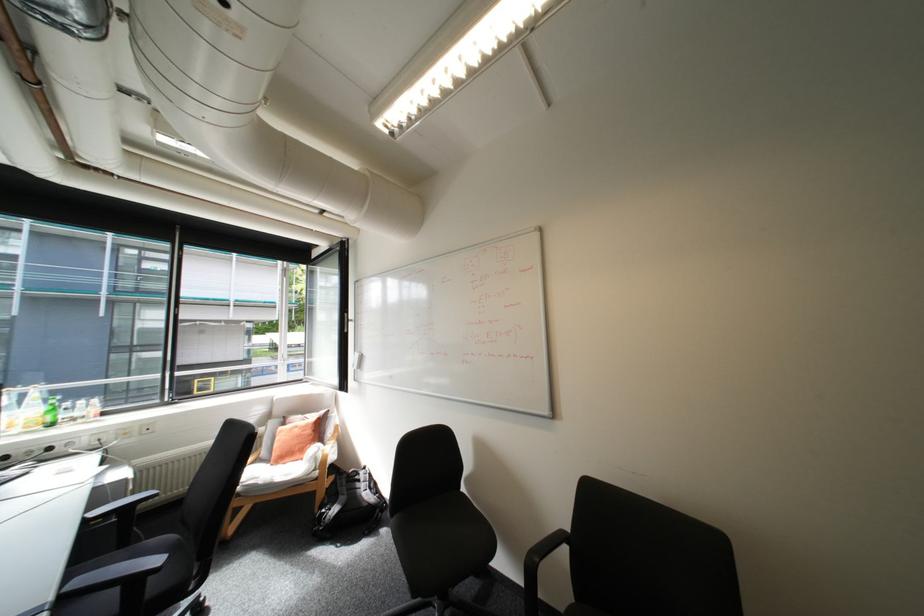
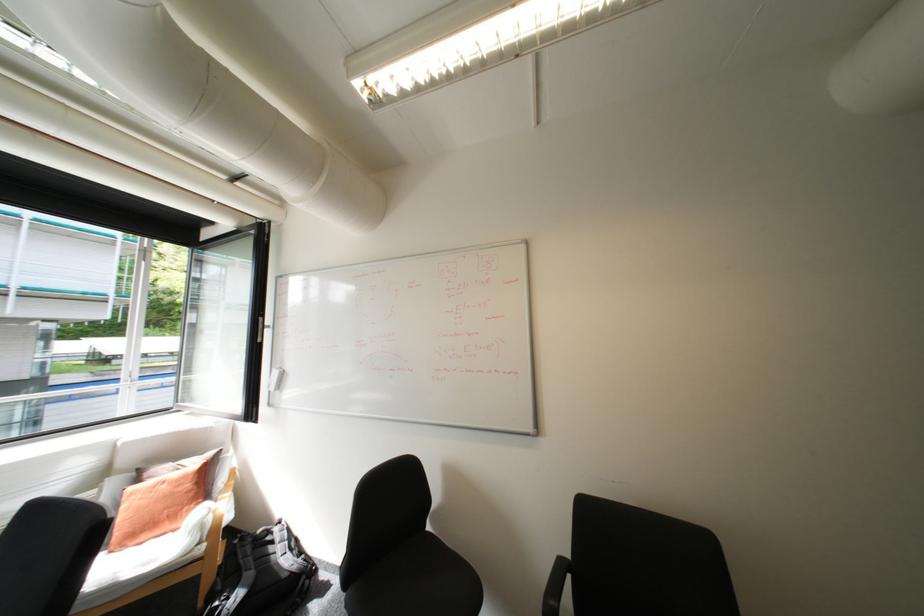
The point at (356,321) is marked in the first image. Where is the corresponding point in the second image?

(271, 326)